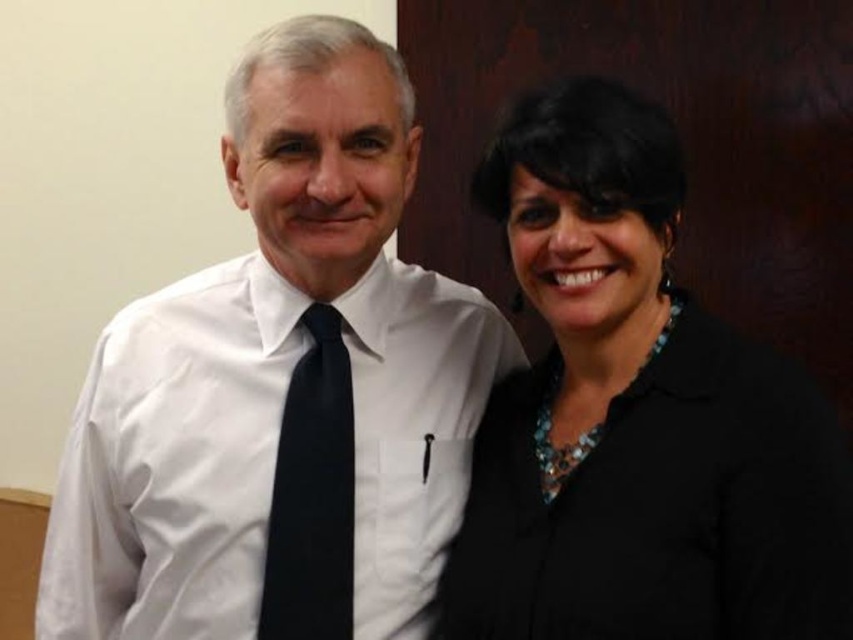
Question: Is white satin shirt at left in front of black satin tie at center?

Choices:
 (A) no
 (B) yes

Answer: (B)

Question: Which point is closer to the camera?

Choices:
 (A) [x=321, y=568]
 (B) [x=618, y=625]

Answer: (B)

Question: Does white satin shirt at left appear under black matte blazer at right?

Choices:
 (A) yes
 (B) no

Answer: (A)

Question: Does white satin shirt at left appear over black matte blazer at right?

Choices:
 (A) no
 (B) yes

Answer: (A)

Question: Which point appears farthest from the camera in this image?

Choices:
 (A) (252, 211)
 (B) (345, 464)

Answer: (B)

Question: Estimate the real-world distances between objects in this image. Which object is closer to the black satin tie at center?

Choices:
 (A) white satin shirt at left
 (B) black matte blazer at right

Answer: (A)